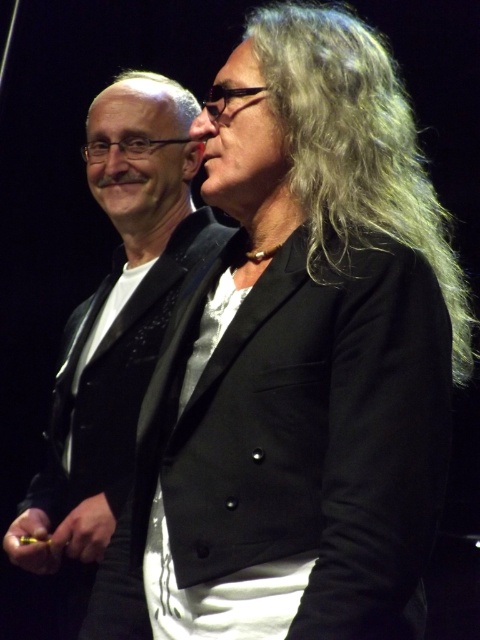
Is gray matte hair at upper right thinner than matte black nose at upper center?

Incorrect, gray matte hair at upper right's width is not less than matte black nose at upper center's.

Does gray matte hair at upper right appear on the right side of matte black nose at upper center?

Yes, gray matte hair at upper right is to the right of matte black nose at upper center.

Is point (309, 262) farther from viewer compared to point (118, 141)?

No.

Where is `gray matte hair at upper right`? gray matte hair at upper right is located at coordinates (355, 148).

Does black glossy suit at center appear on the left side of smooth skin nose at center?

In fact, black glossy suit at center is to the right of smooth skin nose at center.

Which is behind, point (311, 314) or point (205, 129)?

Positioned behind is point (205, 129).

Identify the location of black glossy suit at center. (307, 353).

At what (x,y) coordinates should I click in order to perform the action: click on black glossy suit at center. Please return your answer as a coordinate pair (x, y). Looking at the image, I should click on (307, 353).

Who is shorter, gray matte hair at upper right or smooth skin nose at center?

smooth skin nose at center

Is gray matte hair at upper right smaller than smooth skin nose at center?

No, gray matte hair at upper right is not smaller than smooth skin nose at center.

You are a GUI agent. You are given a task and a screenshot of the screen. Output one action in this format:
    pyautogui.click(x=<x>, y=<y>)
    Task: Click on the gray matte hair at upper right
    
    Given the screenshot: What is the action you would take?
    pyautogui.click(x=355, y=148)

This screenshot has width=480, height=640. I want to click on gray matte hair at upper right, so click(355, 148).